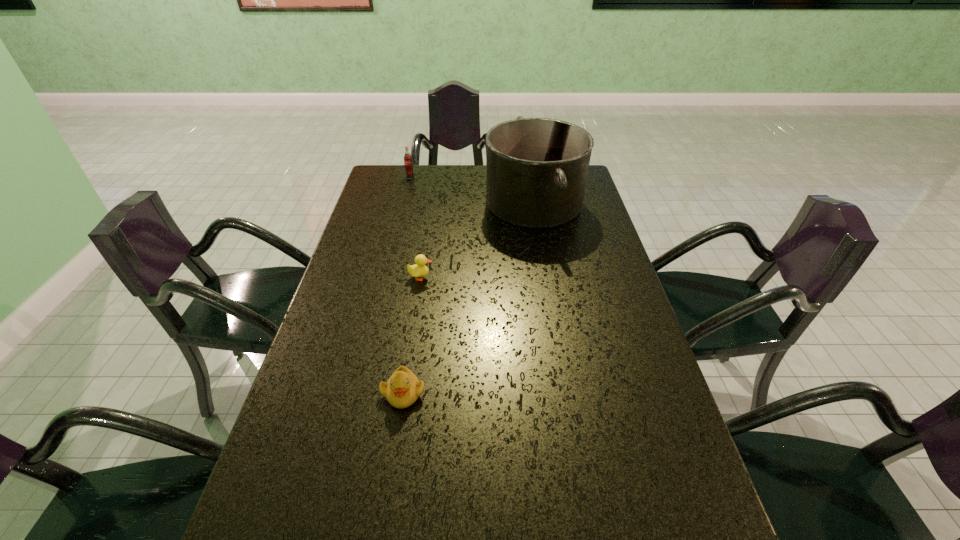
Locate an element on the screen. free space between the farther duckling and the third shortest object is located at coordinates (416, 227).

The height and width of the screenshot is (540, 960). I want to click on empty space that is in between the nearer duckling and the pan, so click(x=468, y=298).

Identify the location of free area in between the nearer duckling and the tallest object. The width and height of the screenshot is (960, 540). (468, 298).

At what (x,y) coordinates should I click in order to perform the action: click on free space between the leftmost object and the rightmost object. Please return your answer as a coordinate pair (x, y). This screenshot has height=540, width=960. Looking at the image, I should click on (471, 190).

Locate an element on the screen. The width and height of the screenshot is (960, 540). vacant space that's between the nearest object and the soda bottle is located at coordinates (406, 285).

Identify which object is the nearest to the leftmost object. Please provide its 2D coordinates. Your answer should be formatted as a tuple, i.e. [(x, y)], where the tuple contains the x and y coordinates of a point satisfying the conditions above.

[(537, 168)]

Where is `the third closest object to the nearer duckling`? This screenshot has width=960, height=540. the third closest object to the nearer duckling is located at coordinates (408, 164).

Identify the location of the second closest duckling to the second tallest object. This screenshot has width=960, height=540. (403, 388).

Locate an element on the screen. free point that satisfies the following two spatial constraints: 1. on the label of the rightmost object; 2. on the left side of the third shortest object is located at coordinates (403, 203).

Where is `vacant space that satisfies the following two spatial constraints: 1. on the label of the rightmost object; 2. on the right side of the second tallest object`? The image size is (960, 540). vacant space that satisfies the following two spatial constraints: 1. on the label of the rightmost object; 2. on the right side of the second tallest object is located at coordinates (403, 203).